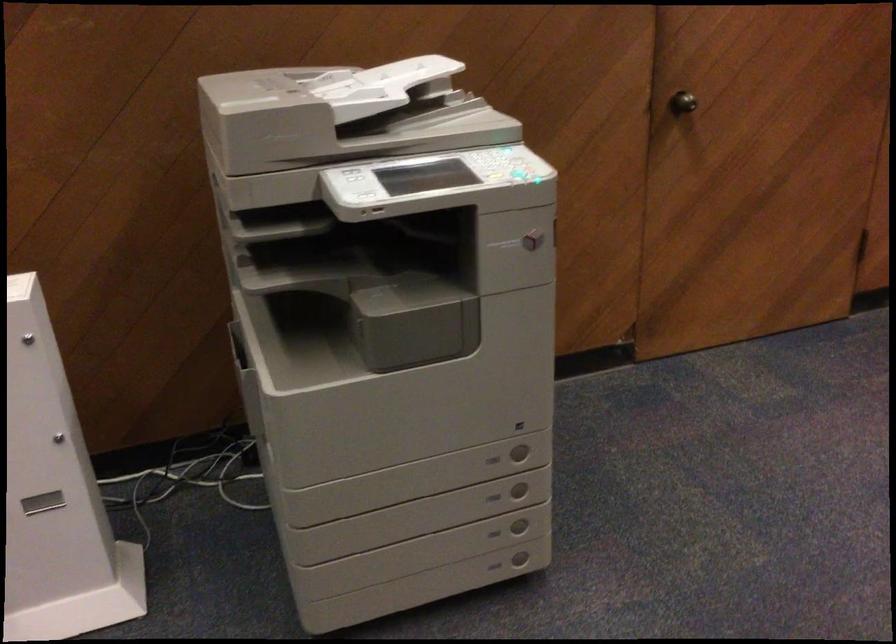
What do you see at coordinates (682, 102) in the screenshot? I see `a grey printer knob` at bounding box center [682, 102].